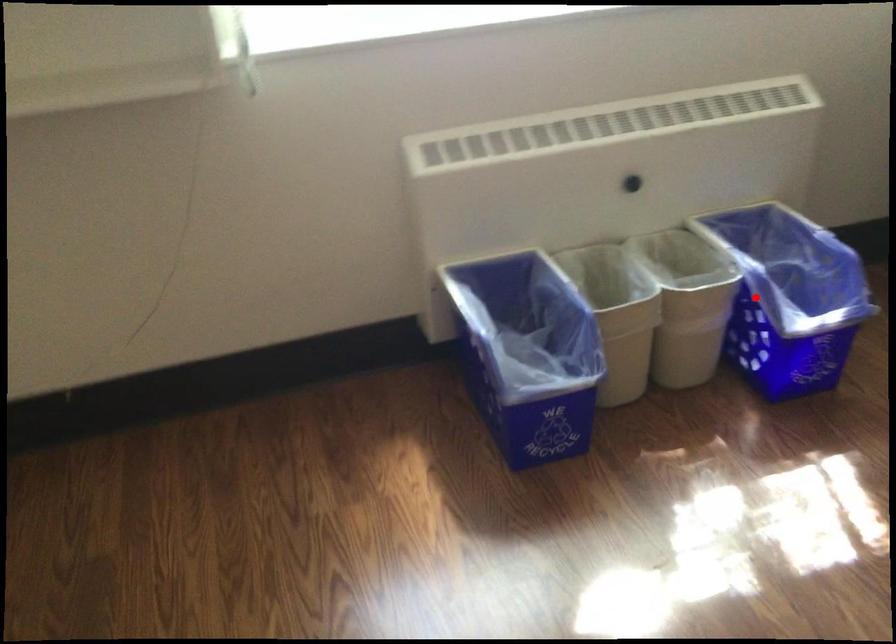
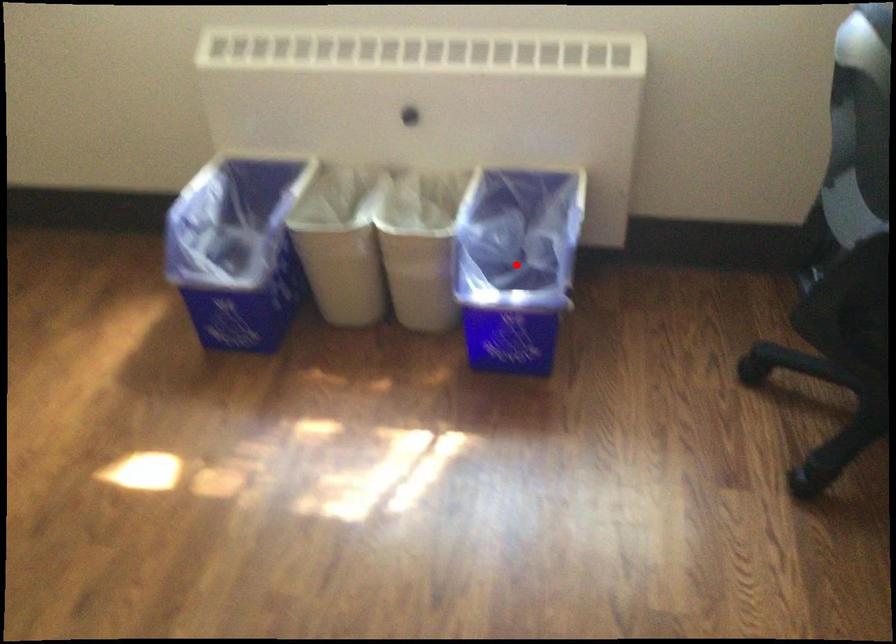
I am providing you with two images of the same scene from different viewpoints. A red point is marked on the first image and another point is marked on the second image. Do the highlighted points in image1 and image2 indicate the same real-world spot?

Yes